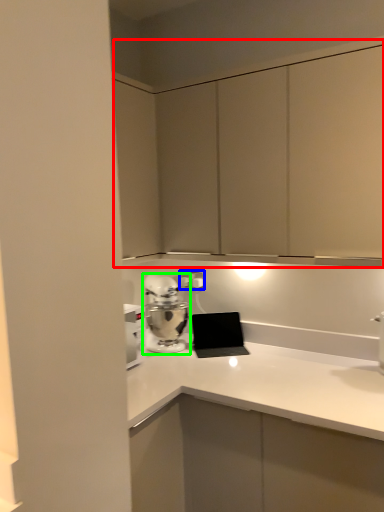
Question: Estimate the real-world distances between objects in this image. Which object is farther from dresser (highlighted by a red box), electric outlet (highlighted by a blue box) or home appliance (highlighted by a green box)?

Choices:
 (A) electric outlet
 (B) home appliance

Answer: (A)